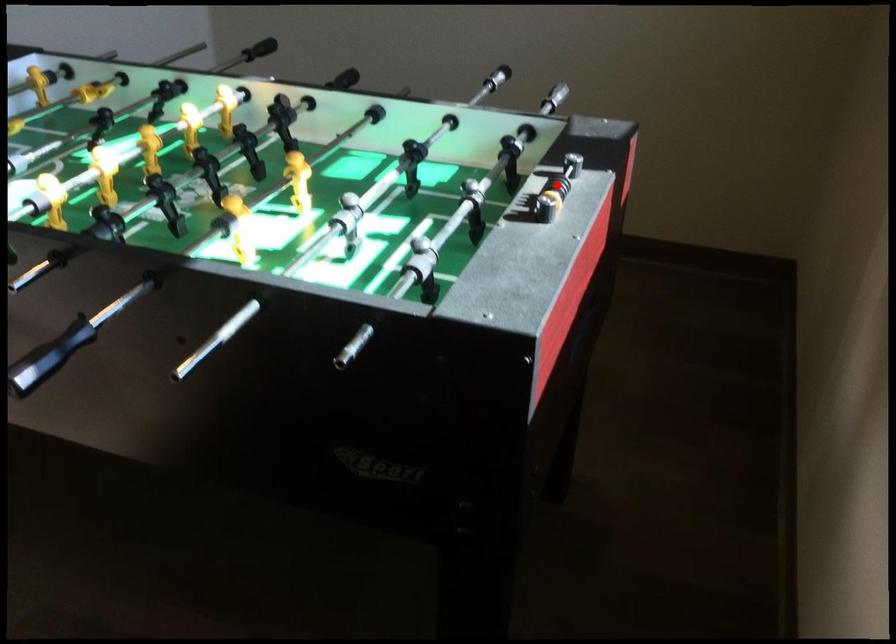
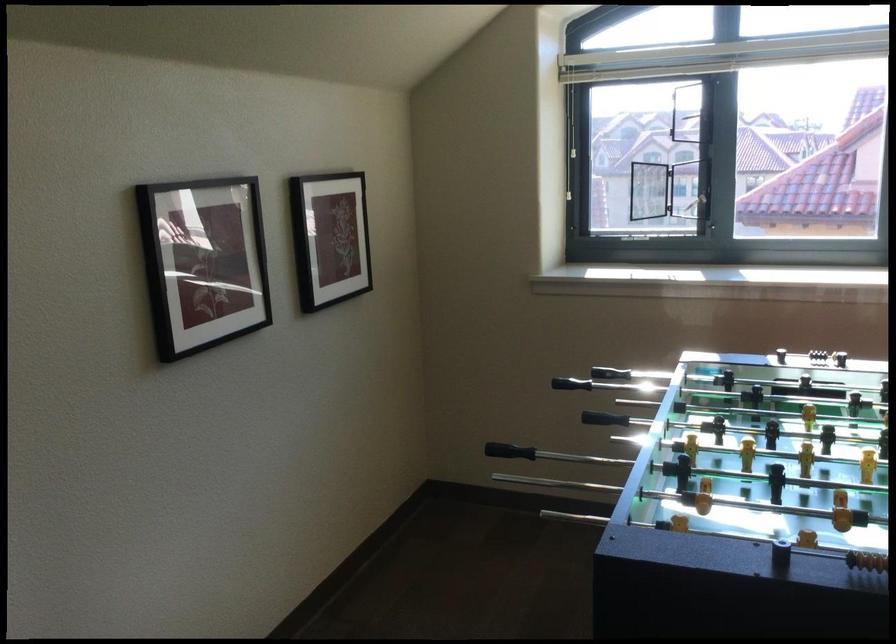
Question: I am providing you with two images of the same scene from different viewpoints. A red point is shown in image1. For the corresponding object point in image2, is it positioned nearer or farther from the camera?

Choices:
 (A) Nearer
 (B) Farther

Answer: (B)